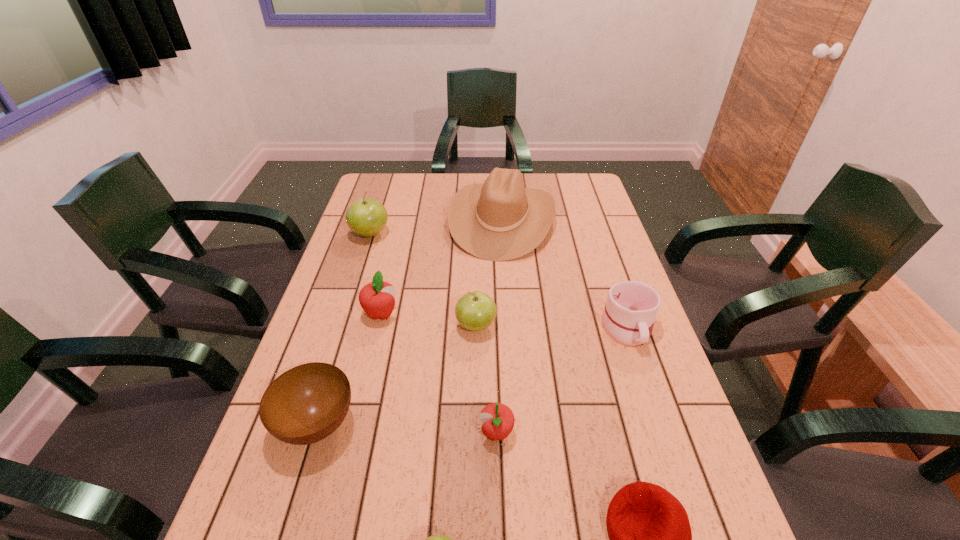
Where is `cowboy hat`? Image resolution: width=960 pixels, height=540 pixels. cowboy hat is located at coordinates (499, 220).

Where is `the second tallest object`? The height and width of the screenshot is (540, 960). the second tallest object is located at coordinates (367, 217).

You are a GUI agent. You are given a task and a screenshot of the screen. Output one action in this format:
    pyautogui.click(x=<x>, y=<y>)
    Task: Click on the farthest green apple
    
    Given the screenshot: What is the action you would take?
    pyautogui.click(x=367, y=217)

Identify the location of the left red apple. (377, 299).

Where is `the farther red apple`? Image resolution: width=960 pixels, height=540 pixels. the farther red apple is located at coordinates (377, 299).

Locate an element on the screen. the second nearest green apple is located at coordinates (475, 311).

Identify the location of mug. This screenshot has height=540, width=960. point(628,317).

Locate an element on the screen. The width and height of the screenshot is (960, 540). bowl is located at coordinates (307, 403).

The height and width of the screenshot is (540, 960). What are the coordinates of `the smaller red apple` in the screenshot? It's located at (498, 419).

Where is `the fourth farthest apple`? Image resolution: width=960 pixels, height=540 pixels. the fourth farthest apple is located at coordinates (498, 419).